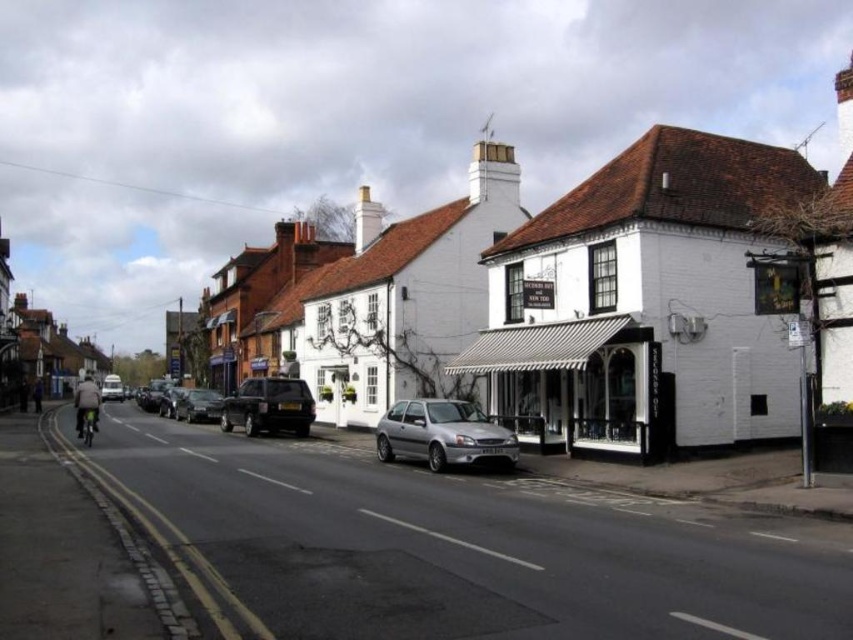
You are a pedestrian standing on the street and want to cross to the other side. There is a shiny black suv at center and a silver metallic car at left. Which vehicle is closer to you?

The silver metallic car at left is closer to you because the shiny black suv at center is above it, indicating it is further away.

You are standing on the quaint street and want to find the white striped awning at center. According to the scene description, where should you look relative to the prominent building with the striped awning?

The white striped awning at center is located at point (572, 381), so you should look towards the center of the image where the coordinates indicate its position relative to the prominent building.